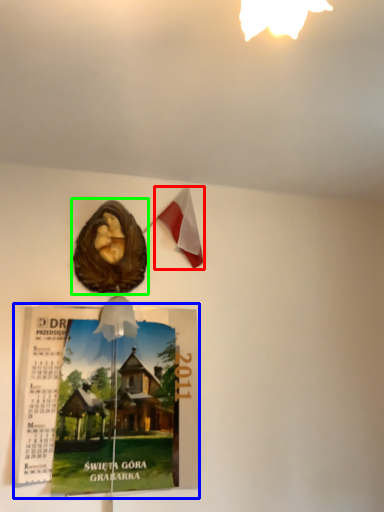
Question: Estimate the real-world distances between objects in this image. Which object is closer to flag (highlighted by a red box), magazine (highlighted by a blue box) or flyer (highlighted by a green box)?

Choices:
 (A) magazine
 (B) flyer

Answer: (B)